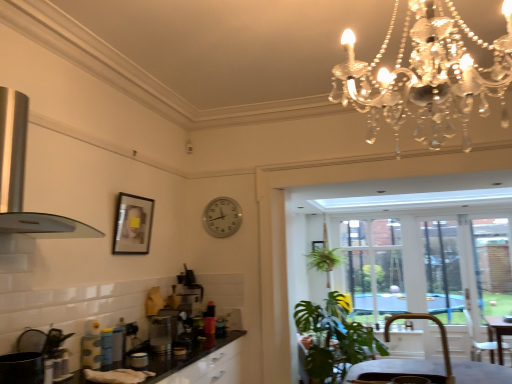
Question: Is satin silver toaster at center completely or partially inside transparent glass door at right, which is the 1th window screen in right-to-left order?

Choices:
 (A) yes
 (B) no

Answer: (B)

Question: From the image's perspective, is transparent glass door at right, marked as the 3th window screen in a left-to-right arrangement, above satin silver toaster at center?

Choices:
 (A) yes
 (B) no

Answer: (B)

Question: Does transparent glass door at right, marked as the 3th window screen in a left-to-right arrangement, have a lesser width compared to satin silver toaster at center?

Choices:
 (A) yes
 (B) no

Answer: (A)

Question: Is transparent glass door at right, which is the 1th window screen in right-to-left order, wider than satin silver toaster at center?

Choices:
 (A) no
 (B) yes

Answer: (A)

Question: Can you confirm if transparent glass door at right, marked as the 3th window screen in a left-to-right arrangement, is taller than satin silver toaster at center?

Choices:
 (A) no
 (B) yes

Answer: (B)

Question: Is transparent glass door at right, which is the 1th window screen in right-to-left order, next to satin silver toaster at center?

Choices:
 (A) yes
 (B) no

Answer: (B)

Question: Is clear glass door at center, which is the 1th window screen in left-to-right order, facing away from satin silver toaster at center?

Choices:
 (A) no
 (B) yes

Answer: (A)

Question: Considering the relative sizes of clear glass door at center, the 3th window screen viewed from the right, and satin silver toaster at center in the image provided, is clear glass door at center, the 3th window screen viewed from the right, wider than satin silver toaster at center?

Choices:
 (A) no
 (B) yes

Answer: (B)

Question: From a real-world perspective, is clear glass door at center, which is the 1th window screen in left-to-right order, below satin silver toaster at center?

Choices:
 (A) no
 (B) yes

Answer: (A)

Question: Is clear glass door at center, the 3th window screen viewed from the right, oriented towards satin silver toaster at center?

Choices:
 (A) no
 (B) yes

Answer: (B)

Question: Are clear glass door at center, the 3th window screen viewed from the right, and satin silver toaster at center located far from each other?

Choices:
 (A) no
 (B) yes

Answer: (B)

Question: From the image's perspective, is clear glass door at center, the 3th window screen viewed from the right, beneath satin silver toaster at center?

Choices:
 (A) yes
 (B) no

Answer: (A)

Question: Would you say transparent glass door at right, which is the 1th window screen in right-to-left order, is part of clear glass door at center, which is the 1th window screen in left-to-right order,'s contents?

Choices:
 (A) yes
 (B) no

Answer: (B)